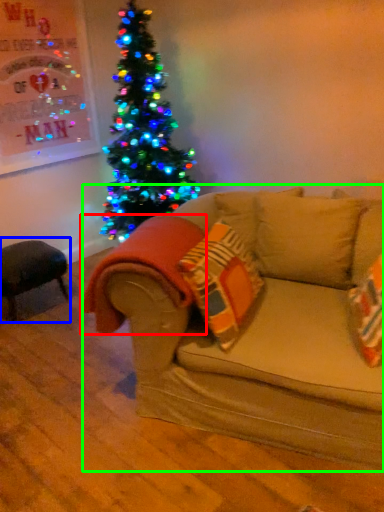
Question: Which is farther away from blanket (highlighted by a red box)? swivel chair (highlighted by a blue box) or studio couch (highlighted by a green box)?

Choices:
 (A) swivel chair
 (B) studio couch

Answer: (A)